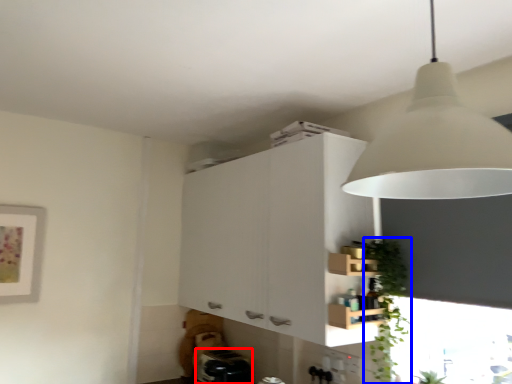
Question: Among these objects, which one is farthest to the camera, appliance (highlighted by a red box) or plant (highlighted by a blue box)?

Choices:
 (A) appliance
 (B) plant

Answer: (A)